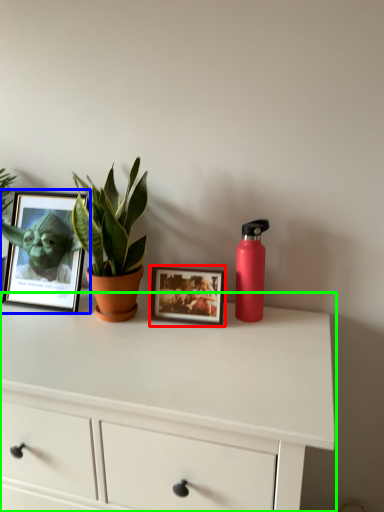
Question: Which object is positioned farthest from picture frame (highlighted by a red box)? Select from picture frame (highlighted by a blue box) and chest of drawers (highlighted by a green box).

Choices:
 (A) picture frame
 (B) chest of drawers

Answer: (A)